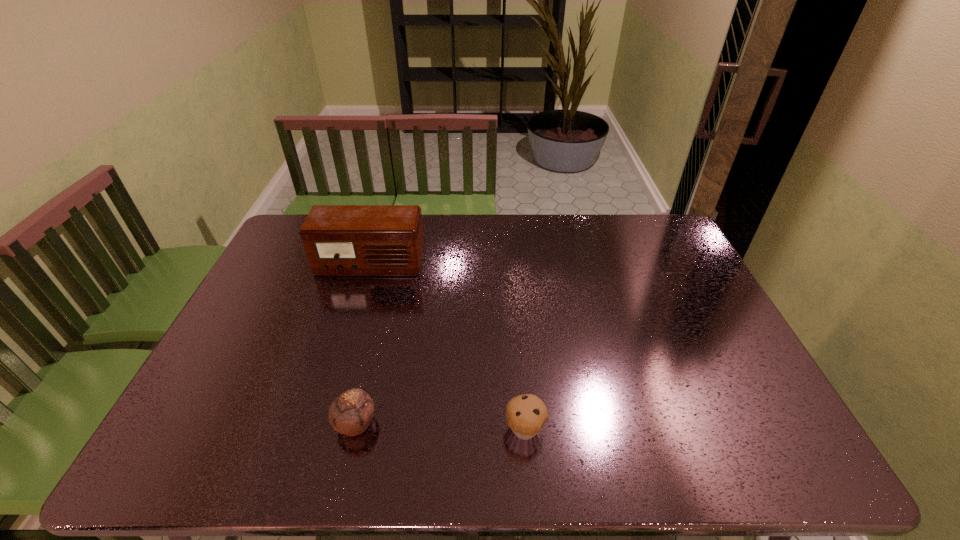
This screenshot has height=540, width=960. Identify the location of free region at the left edge of the desktop. (281, 265).

Locate an element on the screen. This screenshot has width=960, height=540. vacant space that's between the radio receiver and the rightmost object is located at coordinates (447, 347).

Identify the location of free point between the rightmost object and the left muffin. (441, 426).

Locate an element on the screen. vacant space in between the left muffin and the radio receiver is located at coordinates (363, 343).

The width and height of the screenshot is (960, 540). Find the location of `unoccupied area between the rightmost object and the farthest object`. unoccupied area between the rightmost object and the farthest object is located at coordinates click(447, 347).

Where is `free space between the right muffin and the left muffin`? free space between the right muffin and the left muffin is located at coordinates (441, 426).

You are a GUI agent. You are given a task and a screenshot of the screen. Output one action in this format:
    pyautogui.click(x=<x>, y=<y>)
    Task: Click on the free space that is in between the left muffin and the tallest object
    The height and width of the screenshot is (540, 960).
    Given the screenshot: What is the action you would take?
    pyautogui.click(x=363, y=343)

This screenshot has height=540, width=960. What are the coordinates of `free space between the rightmost object and the radio receiver` in the screenshot? It's located at (447, 347).

The width and height of the screenshot is (960, 540). What are the coordinates of `free spot between the left muffin and the farthest object` in the screenshot? It's located at (363, 343).

The image size is (960, 540). In order to click on vacant region between the left muffin and the farthest object in this screenshot , I will do `click(363, 343)`.